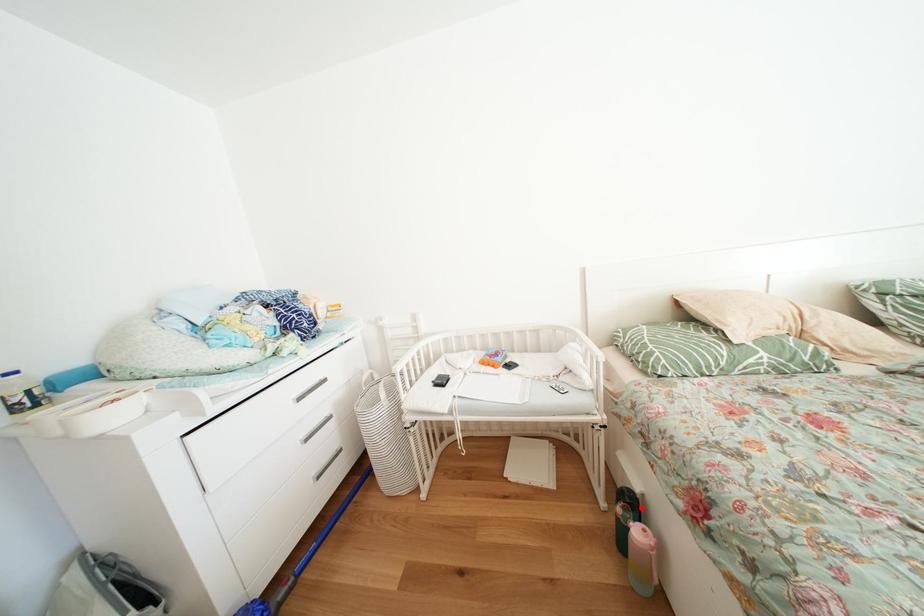
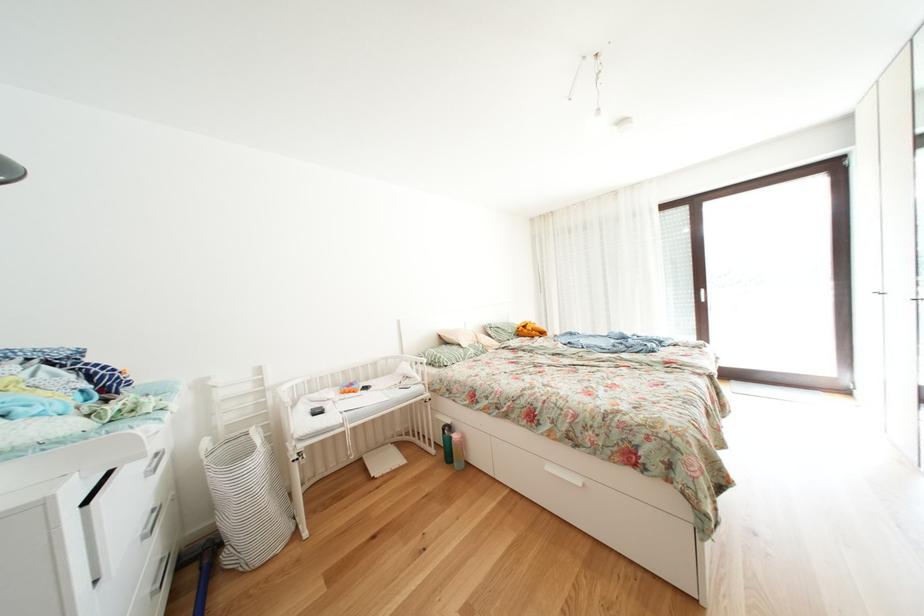
Question: A red point is marked in image1. In image2, is the corresponding 3D point closer to the camera or farther? Reply with the corresponding letter.

Choices:
 (A) The corresponding 3D point is closer.
 (B) The corresponding 3D point is farther.

Answer: (B)